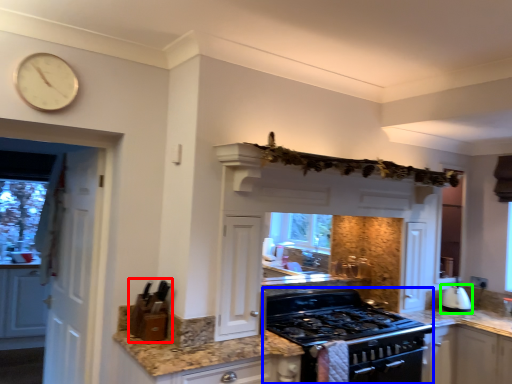
Question: Which object is the farthest from appliance (highlighted by a red box)? Choose among these: appliance (highlighted by a blue box) or kitchen appliance (highlighted by a green box).

Choices:
 (A) appliance
 (B) kitchen appliance

Answer: (B)